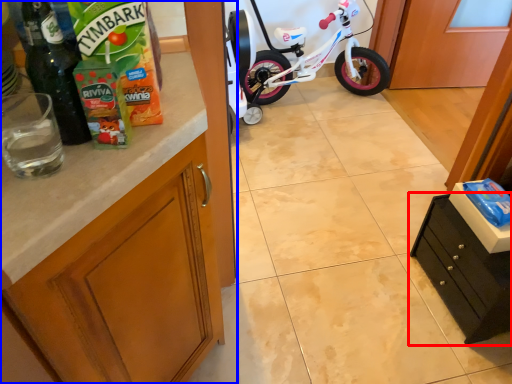
Question: Which object appears closest to the camera in this image, cabinetry (highlighted by a red box) or cabinetry (highlighted by a blue box)?

Choices:
 (A) cabinetry
 (B) cabinetry

Answer: (B)